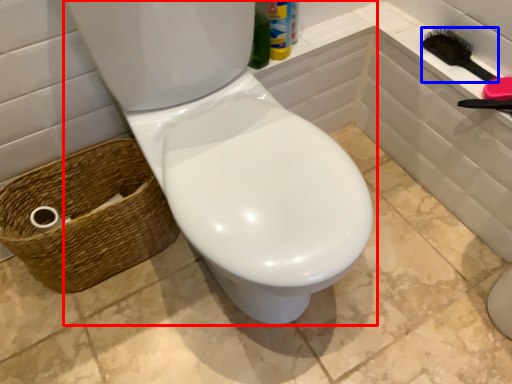
Question: Among these objects, which one is farthest to the camera, toilet (highlighted by a red box) or brush (highlighted by a blue box)?

Choices:
 (A) toilet
 (B) brush

Answer: (B)